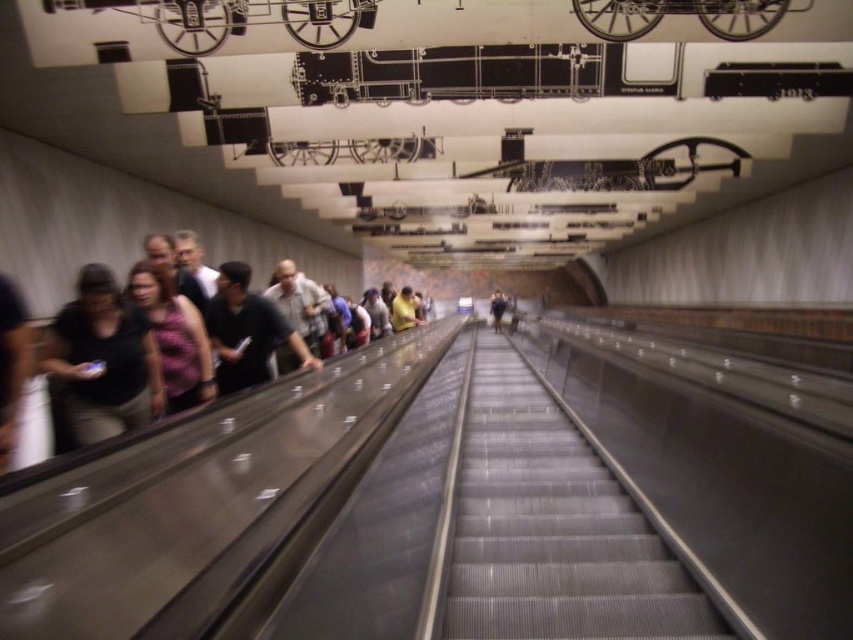
Is metallic gray escalator at center wider than light brown leather jacket at center?

Correct, the width of metallic gray escalator at center exceeds that of light brown leather jacket at center.

Is metallic gray escalator at center further to camera compared to light brown leather jacket at center?

No, it is not.

Where is `metallic gray escalator at center`? metallic gray escalator at center is located at coordinates (553, 528).

Locate an element on the screen. Image resolution: width=853 pixels, height=640 pixels. metallic gray escalator at center is located at coordinates pyautogui.click(x=553, y=528).

Can you confirm if purple floral dress at center is thinner than light brown leather jacket at center?

Correct, purple floral dress at center's width is less than light brown leather jacket at center's.

Which is behind, point (199, 385) or point (500, 310)?

Positioned behind is point (500, 310).

Locate an element on the screen. purple floral dress at center is located at coordinates (173, 337).

Can you confirm if dark gray shirt at left is positioned to the right of purple floral dress at center?

Incorrect, dark gray shirt at left is not on the right side of purple floral dress at center.

Is point (96, 272) farther from viewer compared to point (206, 365)?

No, it is in front of (206, 365).

Who is more distant from viewer, (151, 417) or (207, 356)?

The point (207, 356) is more distant.

Where is `dark gray shirt at left`? Image resolution: width=853 pixels, height=640 pixels. dark gray shirt at left is located at coordinates (103, 358).